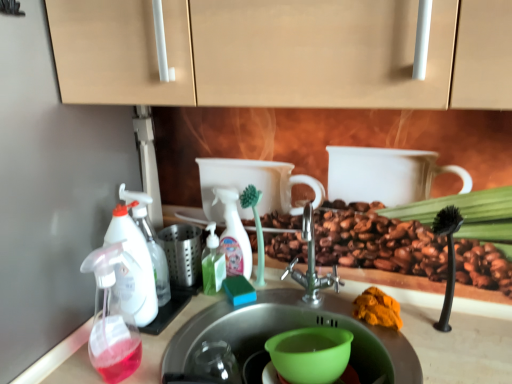
The height and width of the screenshot is (384, 512). What do you see at coordinates (290, 329) in the screenshot?
I see `transparent plastic spray bottle at left, the 1th sink ordered from the bottom` at bounding box center [290, 329].

The width and height of the screenshot is (512, 384). What do you see at coordinates (135, 260) in the screenshot? I see `translucent plastic soap dispenser at left, positioned as the third soap dispenser in right-to-left order` at bounding box center [135, 260].

Locate an element on the screen. translucent plastic spray bottle at center is located at coordinates (234, 235).

Where is `transparent plastic spray bottle at left, the 1th sink ordered from the bottom`? The width and height of the screenshot is (512, 384). transparent plastic spray bottle at left, the 1th sink ordered from the bottom is located at coordinates pos(290,329).

Is translucent plastic spray bottle at left, the 3th soap dispenser viewed from the back, oriented away from green translucent soap dispenser at center, which is the first soap dispenser from back to front?

Absolutely, translucent plastic spray bottle at left, the 3th soap dispenser viewed from the back, is directed away from green translucent soap dispenser at center, which is the first soap dispenser from back to front.

Considering the sizes of objects translucent plastic spray bottle at left, the 3th soap dispenser viewed from the back, and green translucent soap dispenser at center, marked as the first soap dispenser in a right-to-left arrangement, in the image provided, who is taller, translucent plastic spray bottle at left, the 3th soap dispenser viewed from the back, or green translucent soap dispenser at center, marked as the first soap dispenser in a right-to-left arrangement,?

With more height is translucent plastic spray bottle at left, the 3th soap dispenser viewed from the back.

Is translucent plastic spray bottle at left, the 2th soap dispenser when ordered from right to left, directly adjacent to green translucent soap dispenser at center, which is the first soap dispenser from back to front?

translucent plastic spray bottle at left, the 2th soap dispenser when ordered from right to left, is not next to green translucent soap dispenser at center, which is the first soap dispenser from back to front, and they're not touching.

From the image's perspective, between green plastic cup at sink and translucent plastic soap dispenser at left, which ranks as the second soap dispenser in back-to-front order, who is located below?

green plastic cup at sink appears lower in the image.

Is green plastic cup at sink outside of translucent plastic soap dispenser at left, which ranks as the second soap dispenser in back-to-front order?

Absolutely, green plastic cup at sink is external to translucent plastic soap dispenser at left, which ranks as the second soap dispenser in back-to-front order.

Is translucent plastic soap dispenser at left, which ranks as the second soap dispenser in back-to-front order, at the back of green plastic cup at sink?

No, green plastic cup at sink is not facing away from translucent plastic soap dispenser at left, which ranks as the second soap dispenser in back-to-front order.

Does green plastic cup at sink have a larger size compared to translucent plastic soap dispenser at left, positioned as the third soap dispenser in right-to-left order?

Yes, green plastic cup at sink is bigger than translucent plastic soap dispenser at left, positioned as the third soap dispenser in right-to-left order.

This screenshot has width=512, height=384. In order to click on debris that is above the stainless steel sink at center, the 1th sink positioned from the top (from a real-world perspective) in this screenshot , I will do `click(378, 309)`.

Are orange powder at sink and stainless steel sink at center, which is the second sink from bottom to top, far apart?

No, orange powder at sink is not far away from stainless steel sink at center, which is the second sink from bottom to top.

Between point (379, 301) and point (162, 373), which one is positioned behind?

The point (379, 301) is farther.

From the image's perspective, which one is positioned higher, orange powder at sink or stainless steel sink at center, the 1th sink positioned from the top?

orange powder at sink, from the image's perspective.

Would you say translucent plastic spray bottle at center is a long distance from translucent plastic spray bottle at left, the 2th soap dispenser when ordered from right to left?

No, translucent plastic spray bottle at center is not far from translucent plastic spray bottle at left, the 2th soap dispenser when ordered from right to left.

Is translucent plastic spray bottle at center positioned with its back to translucent plastic spray bottle at left, the first soap dispenser positioned from the front?

No, translucent plastic spray bottle at left, the first soap dispenser positioned from the front, is not at the back of translucent plastic spray bottle at center.

Between translucent plastic spray bottle at center and translucent plastic spray bottle at left, the 3th soap dispenser viewed from the back, which one is positioned behind?

translucent plastic spray bottle at center is further away from the camera.

Is point (405, 370) positioned behind point (324, 351)?

That is False.

From a real-world perspective, is transparent plastic spray bottle at left, the 2th sink in the top-to-bottom sequence, below green plastic cup at sink?

Yes, from a real-world perspective, transparent plastic spray bottle at left, the 2th sink in the top-to-bottom sequence, is below green plastic cup at sink.

Between transparent plastic spray bottle at left, the 2th sink in the top-to-bottom sequence, and green plastic cup at sink, which one has less height?

green plastic cup at sink.

Is stainless steel sink at center, the 1th sink positioned from the top, positioned with its back to translucent plastic spray bottle at center?

No, stainless steel sink at center, the 1th sink positioned from the top, is not facing away from translucent plastic spray bottle at center.

Can you confirm if stainless steel sink at center, which is the second sink from bottom to top, is positioned to the right of translucent plastic spray bottle at center?

Yes.

Based on the photo, is the position of stainless steel sink at center, the 1th sink positioned from the top, less distant than that of translucent plastic spray bottle at center?

That is True.

At what (x,y) coordinates should I click in order to perform the action: click on cleaning product on the left of stainless steel sink at center, which is the second sink from bottom to top. Please return your answer as a coordinate pair (x, y). Looking at the image, I should click on (234, 235).

Which of these two, stainless steel sink at center, the 1th sink positioned from the top, or translucent plastic spray bottle at left, the first soap dispenser positioned from the front, is wider?

stainless steel sink at center, the 1th sink positioned from the top.

Can you confirm if stainless steel sink at center, which is the second sink from bottom to top, is smaller than translucent plastic spray bottle at left, which appears as the 2th soap dispenser when viewed from the left?

No, stainless steel sink at center, which is the second sink from bottom to top, is not smaller than translucent plastic spray bottle at left, which appears as the 2th soap dispenser when viewed from the left.

From the picture: Can you confirm if stainless steel sink at center, which is the second sink from bottom to top, is shorter than translucent plastic spray bottle at left, the first soap dispenser positioned from the front?

Yes.

Starting from the translucent plastic spray bottle at left, the first soap dispenser positioned from the front, which soap dispenser is the 2nd one behind? Please provide its 2D coordinates.

[(213, 263)]

This screenshot has width=512, height=384. In order to click on coffee cup to the right of translucent plastic soap dispenser at left, which appears as the 2th soap dispenser when viewed from the front in this screenshot , I will do click(x=310, y=354).

When comparing their distances from green plastic cup at sink, does green translucent soap dispenser at center, which appears as the third soap dispenser when viewed from the front, or translucent plastic spray bottle at left, the first soap dispenser positioned from the front, seem further?

translucent plastic spray bottle at left, the first soap dispenser positioned from the front, is positioned further to the anchor green plastic cup at sink.

Which object lies nearer to the anchor point translucent plastic soap dispenser at left, which ranks as the second soap dispenser in back-to-front order, green translucent soap dispenser at center, which is the first soap dispenser from back to front, or stainless steel sink at center, the 1th sink positioned from the top?

The object closer to translucent plastic soap dispenser at left, which ranks as the second soap dispenser in back-to-front order, is green translucent soap dispenser at center, which is the first soap dispenser from back to front.

Which object lies nearer to the anchor point orange powder at sink, translucent plastic spray bottle at left, which appears as the 2th soap dispenser when viewed from the left, or green plastic cup at sink?

green plastic cup at sink.

Which object lies further to the anchor point green plastic cup at sink, stainless steel sink at center, which is the second sink from bottom to top, or translucent plastic soap dispenser at left, which appears as the 2th soap dispenser when viewed from the front?

Based on the image, translucent plastic soap dispenser at left, which appears as the 2th soap dispenser when viewed from the front, appears to be further to green plastic cup at sink.

When comparing their distances from transparent plastic spray bottle at left, the 1th sink ordered from the bottom, does green translucent soap dispenser at center, which appears as the third soap dispenser when viewed from the front, or orange powder at sink seem closer?

orange powder at sink.

Looking at the image, which one is located further to translucent plastic soap dispenser at left, the 1th soap dispenser when ordered from left to right, transparent plastic spray bottle at left, the 2th sink in the top-to-bottom sequence, or stainless steel sink at center, the 1th sink positioned from the top?

The object further to translucent plastic soap dispenser at left, the 1th soap dispenser when ordered from left to right, is transparent plastic spray bottle at left, the 2th sink in the top-to-bottom sequence.

When comparing their distances from translucent plastic spray bottle at center, does translucent plastic spray bottle at left, which appears as the 2th soap dispenser when viewed from the left, or transparent plastic spray bottle at left, the 1th sink ordered from the bottom, seem closer?

The object closer to translucent plastic spray bottle at center is transparent plastic spray bottle at left, the 1th sink ordered from the bottom.

When comparing their distances from translucent plastic spray bottle at left, the 2th soap dispenser when ordered from right to left, does stainless steel sink at center, the 1th sink positioned from the top, or translucent plastic soap dispenser at left, positioned as the third soap dispenser in right-to-left order, seem further?

stainless steel sink at center, the 1th sink positioned from the top, lies further to translucent plastic spray bottle at left, the 2th soap dispenser when ordered from right to left, than the other object.

Find the location of a particular element. The width and height of the screenshot is (512, 384). coffee cup between translucent plastic spray bottle at center and orange powder at sink from left to right is located at coordinates (310, 354).

Where is `debris between stainless steel sink at center, the 1th sink positioned from the top, and green translucent soap dispenser at center, marked as the first soap dispenser in a right-to-left arrangement, along the z-axis`? This screenshot has width=512, height=384. debris between stainless steel sink at center, the 1th sink positioned from the top, and green translucent soap dispenser at center, marked as the first soap dispenser in a right-to-left arrangement, along the z-axis is located at coordinates (378, 309).

Identify the location of coffee cup between green translucent soap dispenser at center, marked as the 3th soap dispenser in a left-to-right arrangement, and orange powder at sink, in the horizontal direction. [x=310, y=354].

Locate an element on the screen. This screenshot has height=384, width=512. coffee cup situated between translucent plastic spray bottle at left, the 3th soap dispenser viewed from the back, and orange powder at sink from left to right is located at coordinates (310, 354).